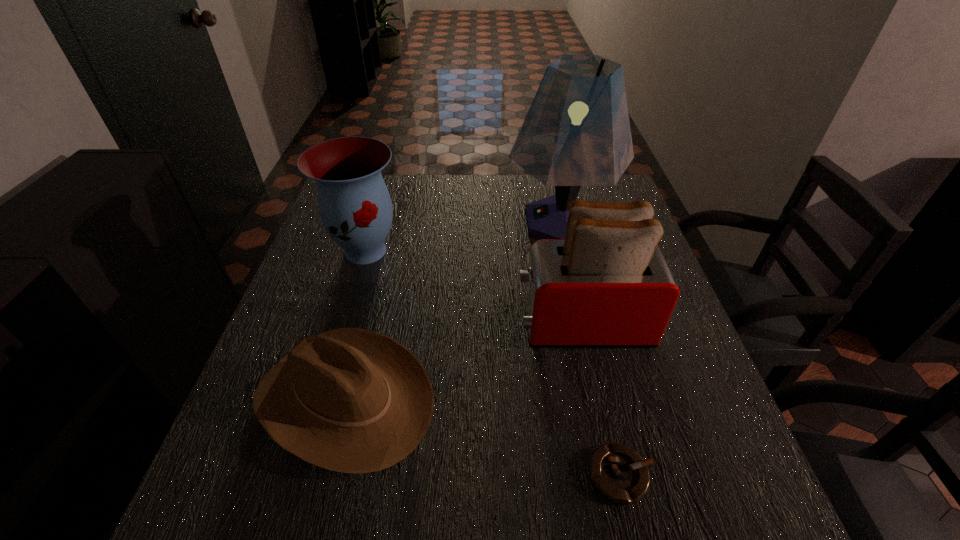
Where is `vacant space situated on the front-facing side of the toaster`? The image size is (960, 540). vacant space situated on the front-facing side of the toaster is located at coordinates (454, 324).

The width and height of the screenshot is (960, 540). What are the coordinates of `free location located on the front of the vase` in the screenshot? It's located at point(354,292).

Locate an element on the screen. The height and width of the screenshot is (540, 960). free location located on the back of the second shortest object is located at coordinates (368, 309).

At what (x,y) coordinates should I click in order to perform the action: click on free space located 0.120m on the left of the shortest object. Please return your answer as a coordinate pair (x, y). The width and height of the screenshot is (960, 540). Looking at the image, I should click on (518, 475).

Where is `object that is at the far edge`? The height and width of the screenshot is (540, 960). object that is at the far edge is located at coordinates (576, 133).

You are a GUI agent. You are given a task and a screenshot of the screen. Output one action in this format:
    pyautogui.click(x=<x>, y=<y>)
    Task: Click on the cowboy hat present at the near edge
    This screenshot has width=960, height=540.
    Given the screenshot: What is the action you would take?
    pyautogui.click(x=351, y=400)

This screenshot has width=960, height=540. I want to click on ashtray that is at the near edge, so click(619, 473).

This screenshot has width=960, height=540. What are the coordinates of `vase that is at the left edge` in the screenshot? It's located at (355, 207).

Image resolution: width=960 pixels, height=540 pixels. Identify the location of cowboy hat located in the left edge section of the desktop. (351, 400).

Where is `lampshade that is at the right edge`? The image size is (960, 540). lampshade that is at the right edge is located at coordinates (576, 133).